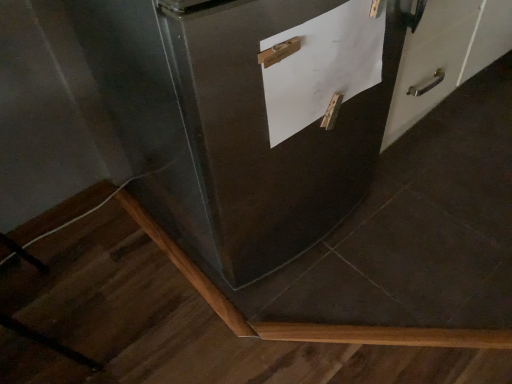
At what (x,y) coordinates should I click in order to perform the action: click on white matte paper at center. Please return your answer as a coordinate pair (x, y). Looking at the image, I should click on (322, 66).

This screenshot has width=512, height=384. What do you see at coordinates (322, 66) in the screenshot?
I see `white matte paper at center` at bounding box center [322, 66].

Where is `white matte paper at center`? Image resolution: width=512 pixels, height=384 pixels. white matte paper at center is located at coordinates (322, 66).